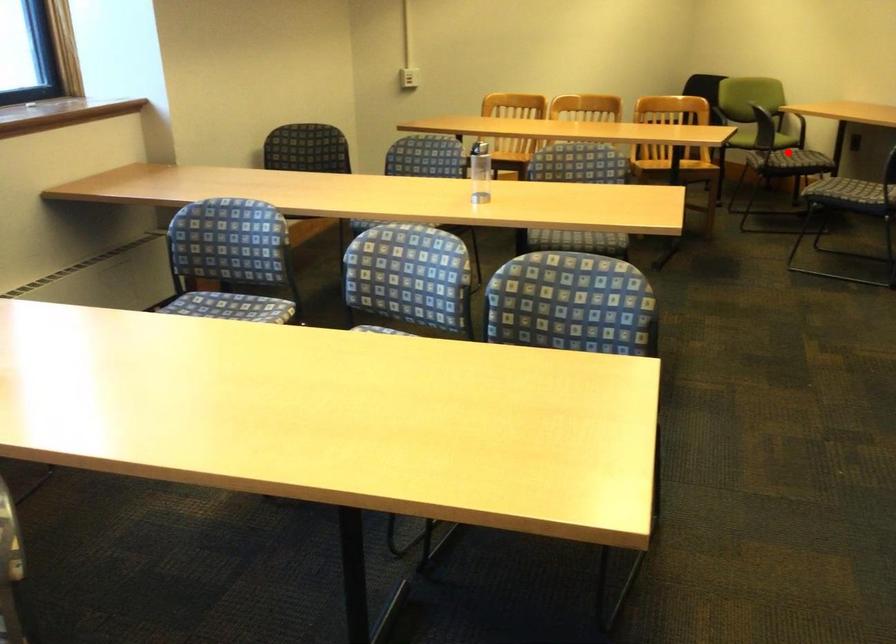
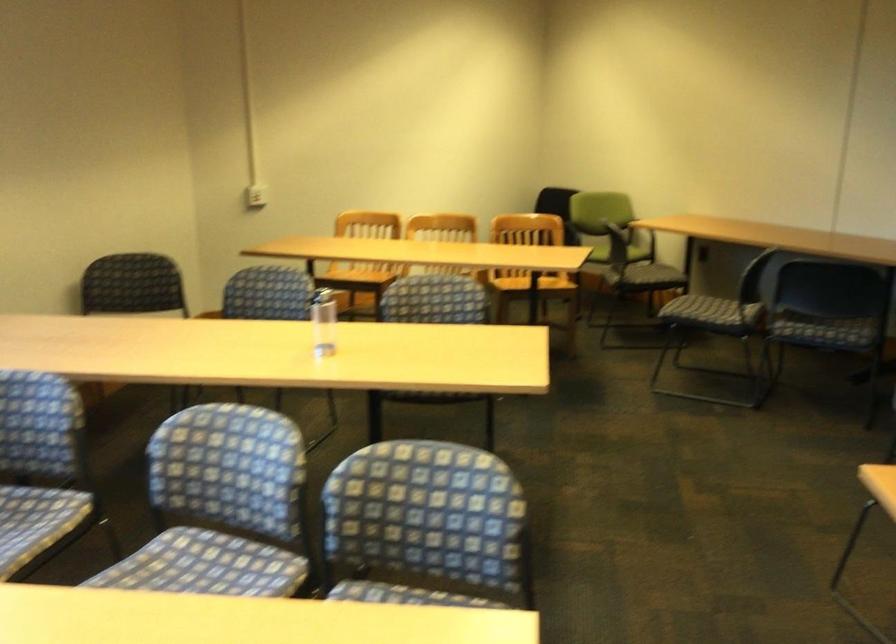
In the second image, find the point that corresponds to the highlighted location in the first image.

(643, 277)